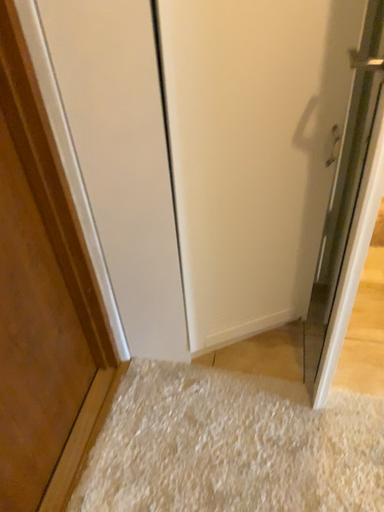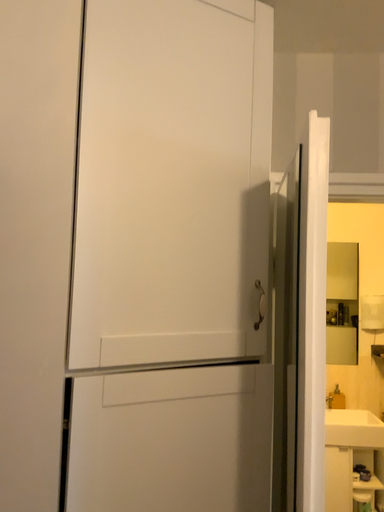
Question: How did the camera likely rotate when shooting the video?

Choices:
 (A) rotated left
 (B) rotated right

Answer: (B)